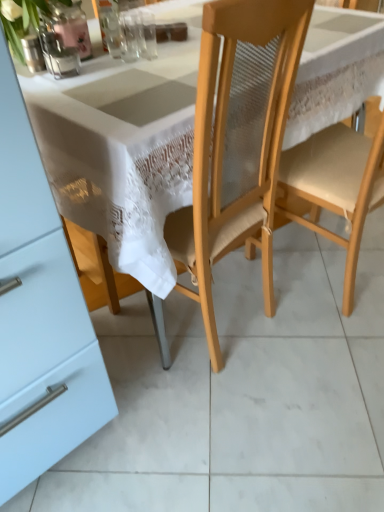
Question: Which direction should I rotate to look at transparent glass at upper center, arranged as the first tableware when viewed from the right, — up or down?

Choices:
 (A) down
 (B) up

Answer: (B)

Question: Considering the relative sizes of clear glass vase at upper center, the second tableware from the right, and matte glass vase at upper left, the third tableware viewed from the right, in the image provided, is clear glass vase at upper center, the second tableware from the right, bigger than matte glass vase at upper left, the third tableware viewed from the right,?

Choices:
 (A) yes
 (B) no

Answer: (A)

Question: Can matte glass vase at upper left, the third tableware viewed from the right, be found inside clear glass vase at upper center, the second tableware from the right?

Choices:
 (A) yes
 (B) no

Answer: (B)

Question: Can you confirm if clear glass vase at upper center, the 2th tableware when ordered from left to right, is smaller than matte glass vase at upper left, which is counted as the first tableware, starting from the left?

Choices:
 (A) no
 (B) yes

Answer: (A)

Question: From a real-world perspective, is clear glass vase at upper center, the 2th tableware when ordered from left to right, positioned under matte glass vase at upper left, which is counted as the first tableware, starting from the left, based on gravity?

Choices:
 (A) no
 (B) yes

Answer: (A)

Question: Is the position of clear glass vase at upper center, the 2th tableware when ordered from left to right, less distant than that of matte glass vase at upper left, which is counted as the first tableware, starting from the left?

Choices:
 (A) no
 (B) yes

Answer: (A)

Question: From the image's perspective, is clear glass vase at upper center, the second tableware from the right, beneath matte glass vase at upper left, which is counted as the first tableware, starting from the left?

Choices:
 (A) no
 (B) yes

Answer: (A)

Question: Can you confirm if light wood chair at center, the 2th chair in the left-to-right sequence, is shorter than wooden chair at center, which ranks as the 2th chair in right-to-left order?

Choices:
 (A) no
 (B) yes

Answer: (B)

Question: From the image's perspective, is light wood chair at center, the 2th chair in the left-to-right sequence, on wooden chair at center, the first chair positioned from the left?

Choices:
 (A) no
 (B) yes

Answer: (B)

Question: Is light wood chair at center, the 1th chair when ordered from right to left, not inside wooden chair at center, which ranks as the 2th chair in right-to-left order?

Choices:
 (A) no
 (B) yes

Answer: (B)

Question: Is light wood chair at center, the 2th chair in the left-to-right sequence, wider than wooden chair at center, which ranks as the 2th chair in right-to-left order?

Choices:
 (A) no
 (B) yes

Answer: (B)

Question: Does light wood chair at center, the 2th chair in the left-to-right sequence, have a greater height compared to wooden chair at center, the first chair positioned from the left?

Choices:
 (A) yes
 (B) no

Answer: (B)

Question: Is light wood chair at center, the 2th chair in the left-to-right sequence, not close to wooden chair at center, the first chair positioned from the left?

Choices:
 (A) yes
 (B) no

Answer: (B)

Question: Is light wood chair at center, the 2th chair in the left-to-right sequence, looking in the opposite direction of matte glass vase at upper left, which is counted as the first tableware, starting from the left?

Choices:
 (A) no
 (B) yes

Answer: (A)